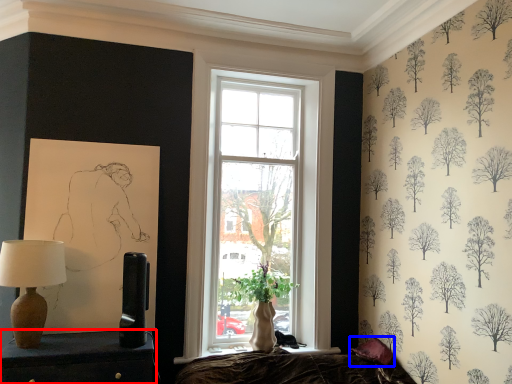
Question: Which point is further to the camera, furniture (highlighted by a red box) or pillow (highlighted by a blue box)?

Choices:
 (A) furniture
 (B) pillow

Answer: (B)